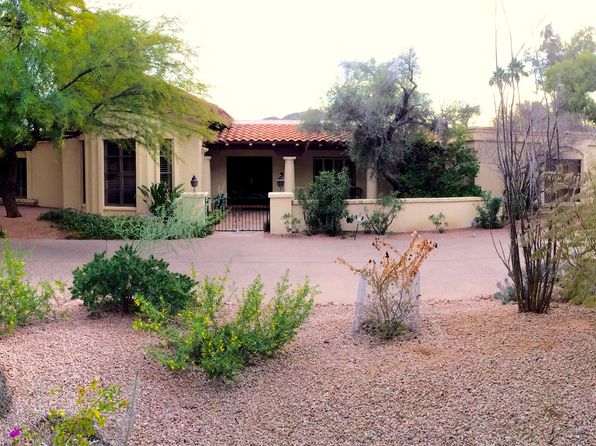
This screenshot has width=596, height=446. Find the location of `windowsill to the left`. windowsill to the left is located at coordinates click(30, 202).